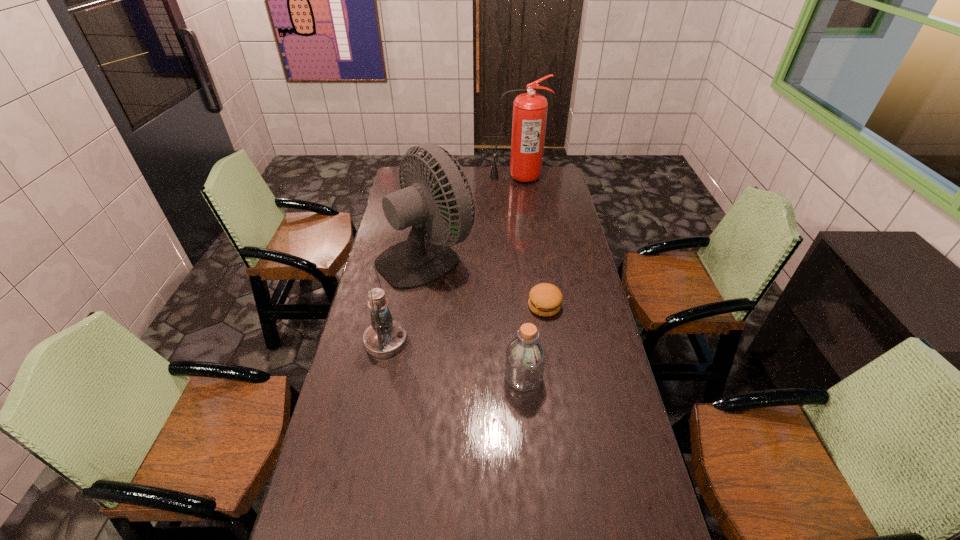
I want to click on free space located on the back of the third tallest object, so click(x=396, y=294).

Where is `vacant space located 0.210m on the left of the fourth tallest object`? Image resolution: width=960 pixels, height=540 pixels. vacant space located 0.210m on the left of the fourth tallest object is located at coordinates (439, 377).

Identify the location of free space located 0.400m on the left of the third nearest object. This screenshot has width=960, height=540. (421, 306).

You are a GUI agent. You are given a task and a screenshot of the screen. Output one action in this format:
    pyautogui.click(x=<x>, y=<y>)
    Task: Click on the object that is at the far edge
    
    Given the screenshot: What is the action you would take?
    pyautogui.click(x=529, y=119)

Where is `fan located at the left edge`? The height and width of the screenshot is (540, 960). fan located at the left edge is located at coordinates (419, 260).

Image resolution: width=960 pixels, height=540 pixels. I want to click on oil lamp positioned at the left edge, so click(385, 337).

I want to click on fire extinguisher located in the right edge section of the desktop, so click(529, 119).

The height and width of the screenshot is (540, 960). Identify the location of hamburger at the right edge. (545, 299).

You are a GUI agent. You are given a task and a screenshot of the screen. Output one action in this format:
    pyautogui.click(x=<x>, y=<y>)
    Task: Click on the object that is at the far right corner
    
    Given the screenshot: What is the action you would take?
    pyautogui.click(x=529, y=119)

In order to click on vacant area at the far edge of the desktop in this screenshot , I will do `click(477, 179)`.